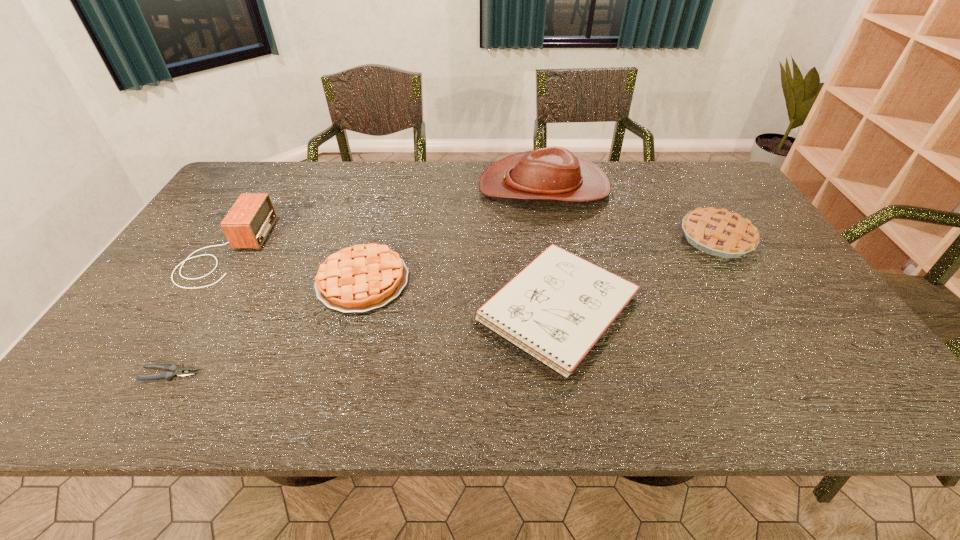
Find the location of a particular element. vacant region located on the front-facing side of the radio receiver is located at coordinates (279, 251).

Where is `free location located 0.140m on the back of the right pie`? free location located 0.140m on the back of the right pie is located at coordinates (688, 191).

I want to click on vacant space situated 0.100m on the back of the fourth object from right to left, so click(377, 229).

I want to click on free space located 0.120m on the right of the notepad, so click(x=693, y=309).

The image size is (960, 540). Find the location of `vacant space positioned 0.260m at the gripping part of the pliers`. vacant space positioned 0.260m at the gripping part of the pliers is located at coordinates (321, 374).

In order to click on object that is positioned at the far edge in this screenshot , I will do point(553,173).

The width and height of the screenshot is (960, 540). I want to click on notepad situated at the near edge, so click(556, 309).

Image resolution: width=960 pixels, height=540 pixels. Find the location of `pliers present at the near edge`. pliers present at the near edge is located at coordinates (174, 371).

Where is `radio receiver located at the left edge`? radio receiver located at the left edge is located at coordinates (249, 221).

Where is `pliers present at the left edge`? pliers present at the left edge is located at coordinates (174, 371).